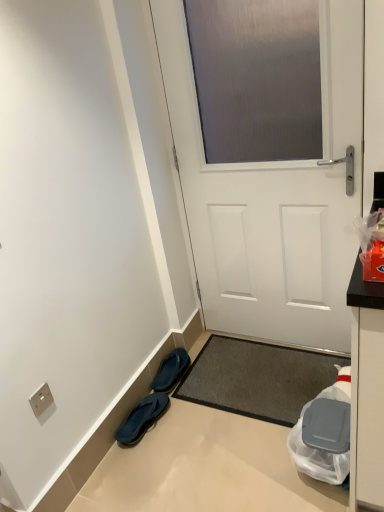
Identify the location of vacant space to the right of blue rubber flip-flops at lower left, the 1th footwear viewed from the front. The width and height of the screenshot is (384, 512). (185, 420).